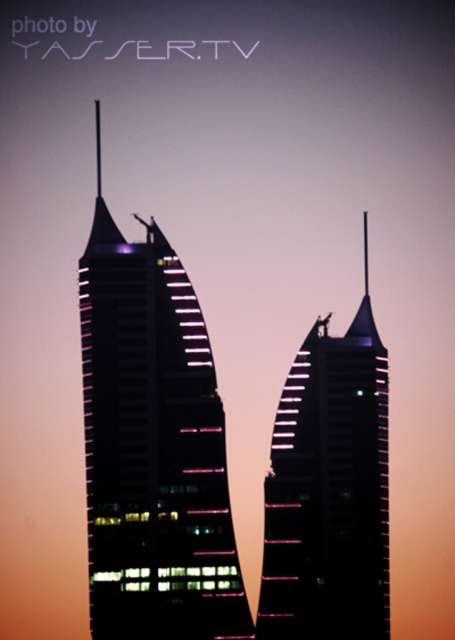
Does matte glass skyscraper at center have a greater height compared to black glass skyscraper at center?

Indeed, matte glass skyscraper at center has a greater height compared to black glass skyscraper at center.

Who is more forward, (106, 605) or (385, 412)?

Point (385, 412) is in front.

Locate an element on the screen. The image size is (455, 640). matte glass skyscraper at center is located at coordinates (152, 445).